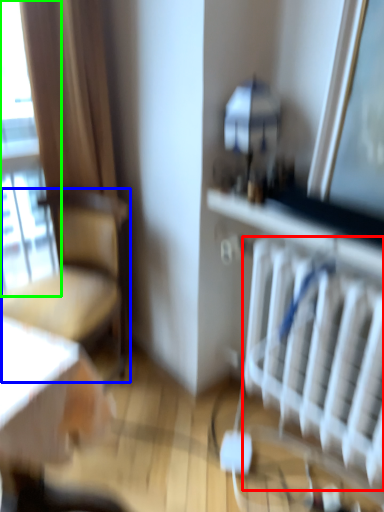
Question: Which object is the farthest from radiator (highlighted by a red box)? Choose among these: chair (highlighted by a blue box) or window (highlighted by a green box).

Choices:
 (A) chair
 (B) window

Answer: (B)